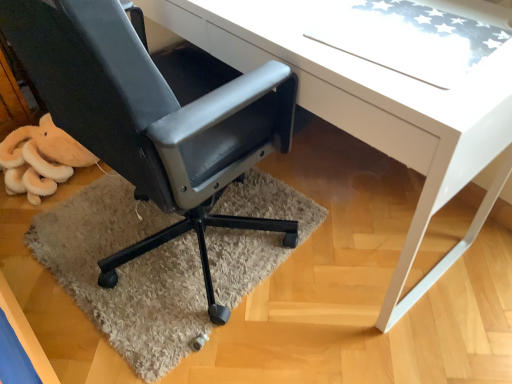
Locate an element on the screen. This screenshot has width=512, height=384. vacant point to the right of beige shaggy rug at lower left is located at coordinates (364, 241).